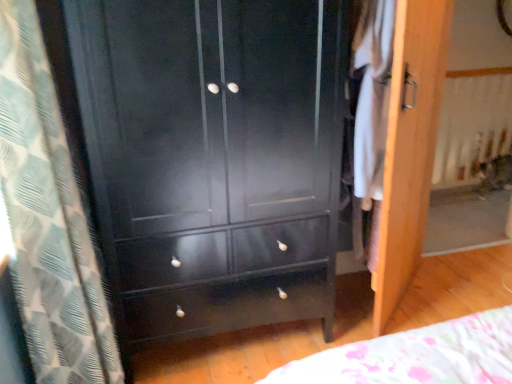
Measure the distance between point (370, 75) and camera.

Point (370, 75) is 5.01 feet from camera.

Where is `white fabric at right`? white fabric at right is located at coordinates (371, 116).

Locate an element on the screen. Image resolution: width=512 pixels, height=384 pixels. white textured curtain at left is located at coordinates (48, 218).

This screenshot has height=384, width=512. What do you see at coordinates (214, 158) in the screenshot?
I see `matte black cabinet at center` at bounding box center [214, 158].

Image resolution: width=512 pixels, height=384 pixels. Identify the location of white fabric at right. (371, 116).

From the image's perspective, is matte black cabinet at center above wooden screen door at right?

Incorrect, from the image's perspective, matte black cabinet at center is lower than wooden screen door at right.

How different are the orientations of matte black cabinet at center and wooden screen door at right in degrees?

The angle between the facing direction of matte black cabinet at center and the facing direction of wooden screen door at right is 42.4 degrees.

Is the position of matte black cabinet at center less distant than that of wooden screen door at right?

Yes, the depth of matte black cabinet at center is less than that of wooden screen door at right.

In terms of height, does matte black cabinet at center look taller or shorter compared to wooden screen door at right?

Clearly, matte black cabinet at center is taller compared to wooden screen door at right.

From a real-world perspective, is white textured curtain at left over white fabric at right?

Actually, white textured curtain at left is physically below white fabric at right in the real world.

From the image's perspective, is white textured curtain at left above or below white fabric at right?

white textured curtain at left is below white fabric at right.

Relative to white fabric at right, is white textured curtain at left in front or behind?

Clearly, white textured curtain at left is in front of white fabric at right.

What's the angular difference between white textured curtain at left and white fabric at right's facing directions?

The facing directions of white textured curtain at left and white fabric at right are 140 degrees apart.

From a real-world perspective, is white fabric at right below matte black cabinet at center?

No.

How different are the orientations of white fabric at right and matte black cabinet at center in degrees?

The angular difference between white fabric at right and matte black cabinet at center is 47.6 degrees.

Looking at this image, does white fabric at right turn towards matte black cabinet at center?

Yes, white fabric at right is oriented towards matte black cabinet at center.

Considering the sizes of objects white textured curtain at left and wooden screen door at right in the image provided, who is smaller, white textured curtain at left or wooden screen door at right?

wooden screen door at right.

From their relative heights in the image, would you say white textured curtain at left is taller or shorter than wooden screen door at right?

Considering their sizes, white textured curtain at left has more height than wooden screen door at right.

Considering the relative sizes of white textured curtain at left and wooden screen door at right in the image provided, is white textured curtain at left wider than wooden screen door at right?

Correct, the width of white textured curtain at left exceeds that of wooden screen door at right.

Looking at this image, is white textured curtain at left situated inside wooden screen door at right or outside?

white textured curtain at left lies outside wooden screen door at right.

Can you confirm if white textured curtain at left is shorter than matte black cabinet at center?

Correct, white textured curtain at left is not as tall as matte black cabinet at center.

How far apart are white textured curtain at left and matte black cabinet at center?

The distance of white textured curtain at left from matte black cabinet at center is 15.92 inches.

In the scene shown: Is white textured curtain at left to the left of matte black cabinet at center from the viewer's perspective?

Indeed, white textured curtain at left is positioned on the left side of matte black cabinet at center.

Is white textured curtain at left thinner than matte black cabinet at center?

Indeed, white textured curtain at left has a lesser width compared to matte black cabinet at center.

Locate an element on the screen. clothing that is in front of the wooden screen door at right is located at coordinates (371, 116).

Which of these two, wooden screen door at right or white fabric at right, stands shorter?

white fabric at right is shorter.

Between point (434, 46) and point (388, 61), which one is positioned behind?

The point (434, 46) is farther from the camera.

Is wooden screen door at right far from white fabric at right?

No, wooden screen door at right is in close proximity to white fabric at right.

Which of these two, wooden screen door at right or white textured curtain at left, is smaller?

With smaller size is wooden screen door at right.

Looking at this image, how many degrees apart are the facing directions of wooden screen door at right and white textured curtain at left?

wooden screen door at right and white textured curtain at left are facing 50.3 degrees away from each other.

Does point (396, 88) appear closer or farther from the camera than point (39, 304)?

Point (396, 88) is farther from the camera than point (39, 304).

From the picture: Does wooden screen door at right have a greater height compared to white textured curtain at left?

In fact, wooden screen door at right may be shorter than white textured curtain at left.

Where is `chest of drawers on the left of wooden screen door at right`? chest of drawers on the left of wooden screen door at right is located at coordinates (214, 158).

The width and height of the screenshot is (512, 384). Identify the location of clothing on the right of white textured curtain at left. (371, 116).

Which object lies further to the anchor point matte black cabinet at center, white textured curtain at left or white fabric at right?

The object further to matte black cabinet at center is white fabric at right.

Based on their spatial positions, is wooden screen door at right or white fabric at right closer to white textured curtain at left?

white fabric at right is positioned closer to the anchor white textured curtain at left.

Estimate the real-world distances between objects in this image. Which object is further from matte black cabinet at center, white textured curtain at left or wooden screen door at right?

wooden screen door at right.

Considering their positions, is white textured curtain at left positioned further to wooden screen door at right than matte black cabinet at center?

white textured curtain at left lies further to wooden screen door at right than the other object.

Which object lies nearer to the anchor point wooden screen door at right, matte black cabinet at center or white textured curtain at left?

matte black cabinet at center is closer to wooden screen door at right.

When comparing their distances from wooden screen door at right, does white fabric at right or matte black cabinet at center seem closer?

Among the two, white fabric at right is located nearer to wooden screen door at right.

From the image, which object appears to be farther from wooden screen door at right, matte black cabinet at center or white fabric at right?

matte black cabinet at center lies further to wooden screen door at right than the other object.

Estimate the real-world distances between objects in this image. Which object is further from white fabric at right, white textured curtain at left or matte black cabinet at center?

Among the two, white textured curtain at left is located further to white fabric at right.

The image size is (512, 384). What are the coordinates of `clothing situated between white textured curtain at left and wooden screen door at right from left to right` in the screenshot? It's located at (371, 116).

Where is `the chest of drawers situated between white textured curtain at left and wooden screen door at right from left to right`? This screenshot has height=384, width=512. the chest of drawers situated between white textured curtain at left and wooden screen door at right from left to right is located at coordinates (214, 158).

Locate an element on the screen. clothing between matte black cabinet at center and wooden screen door at right in the horizontal direction is located at coordinates (371, 116).

I want to click on the chest of drawers located between white textured curtain at left and white fabric at right in the left-right direction, so click(214, 158).